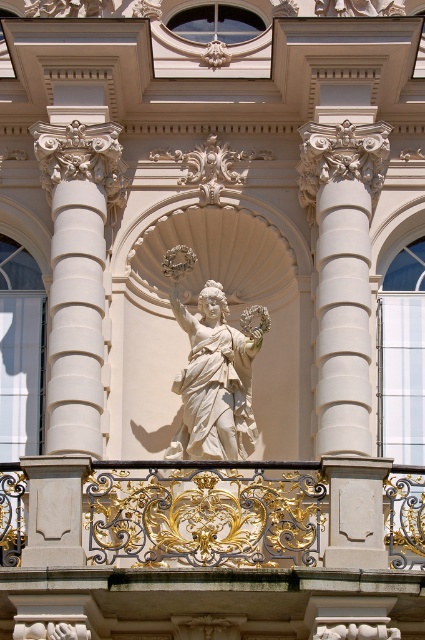
Question: Which object appears closest to the camera in this image?

Choices:
 (A) gold wrought iron at center
 (B) white marble statue at center

Answer: (A)

Question: Which point is closer to the camera?

Choices:
 (A) gold wrought iron at center
 (B) white marble statue at center

Answer: (A)

Question: Does gold wrought iron at center have a lesser width compared to white marble statue at center?

Choices:
 (A) no
 (B) yes

Answer: (A)

Question: Can you confirm if gold wrought iron at center is bigger than white marble statue at center?

Choices:
 (A) no
 (B) yes

Answer: (A)

Question: Is gold wrought iron at center to the left of white marble statue at center from the viewer's perspective?

Choices:
 (A) yes
 (B) no

Answer: (B)